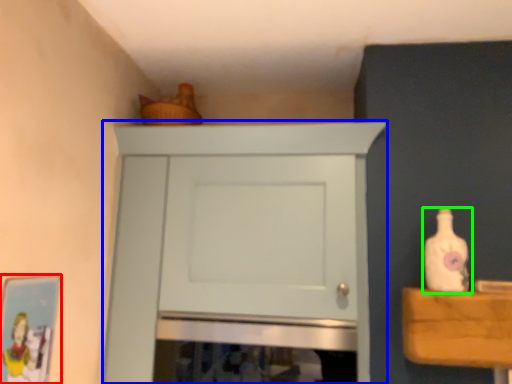
Question: Considering the real-world distances, which object is farthest from picture frame (highlighted by a red box)? cupboard (highlighted by a blue box) or bottle (highlighted by a green box)?

Choices:
 (A) cupboard
 (B) bottle

Answer: (B)